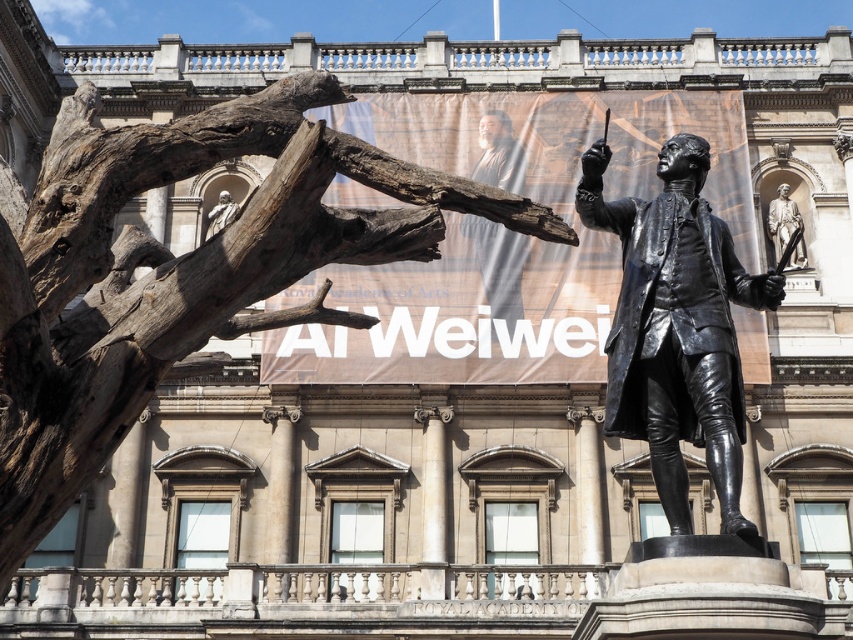
Does brown textured fabric at upper center have a lesser width compared to bronze statue at upper right?

In fact, brown textured fabric at upper center might be wider than bronze statue at upper right.

Who is higher up, brown textured fabric at upper center or bronze statue at upper right?

Positioned higher is bronze statue at upper right.

Between point (480, 134) and point (798, 260), which one is positioned behind?

The point (480, 134) is behind.

This screenshot has width=853, height=640. In order to click on brown textured fabric at upper center in this screenshot , I will do `click(498, 266)`.

Is point (140, 180) less distant than point (724, 234)?

Yes, it is in front of point (724, 234).

Consider the image. Measure the distance between brown rough wood at left and camera.

A distance of 25.35 meters exists between brown rough wood at left and camera.

Is point (177, 122) closer to viewer compared to point (619, 292)?

No, it is behind (619, 292).

This screenshot has height=640, width=853. What are the coordinates of `brown rough wood at left` in the screenshot? It's located at (178, 269).

Is bronze statue at center wider than bronze statue at upper right?

Indeed, bronze statue at center has a greater width compared to bronze statue at upper right.

Which is in front, point (650, 244) or point (782, 221)?

Point (650, 244)

The height and width of the screenshot is (640, 853). In order to click on bronze statue at center in this screenshot , I will do `click(677, 326)`.